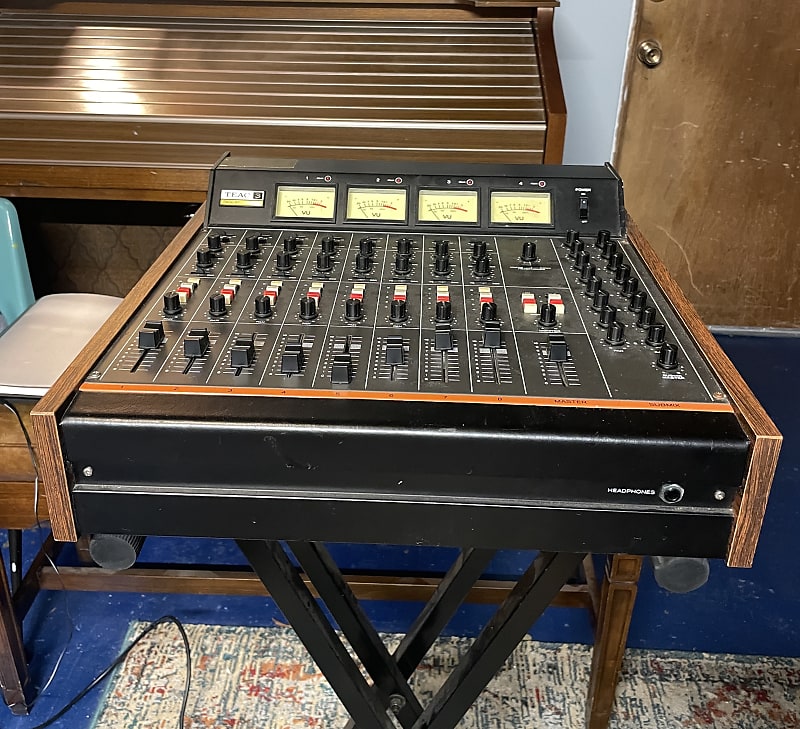
The height and width of the screenshot is (729, 800). I want to click on wooden edge of box, so click(765, 447), click(93, 354).